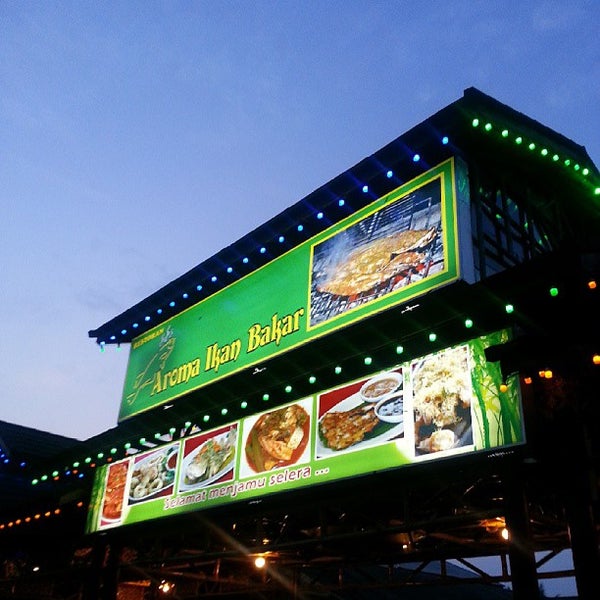
This screenshot has width=600, height=600. In order to click on lights in this screenshot , I will do `click(165, 585)`, `click(260, 559)`, `click(502, 535)`.